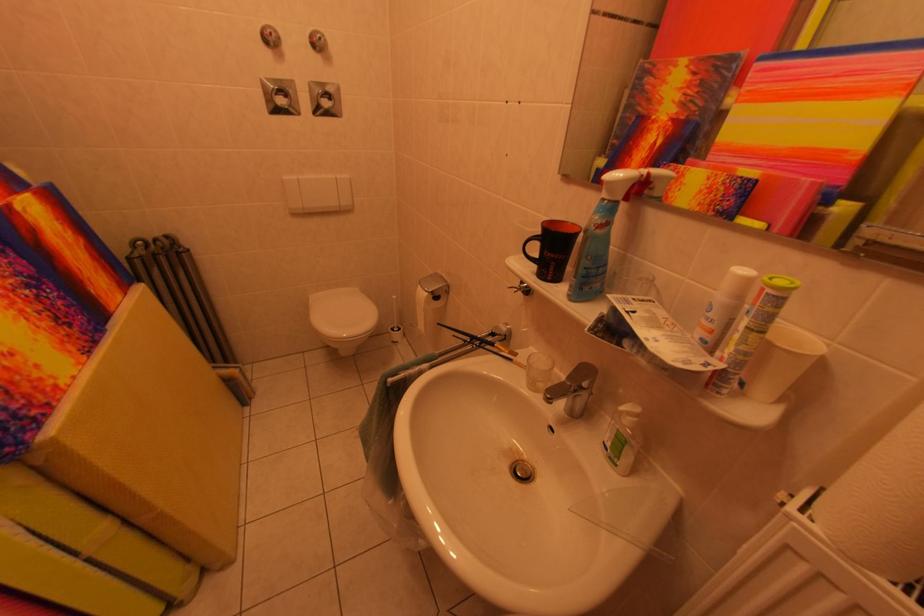
Find where to lift the toilet seat. Please return your answer as a coordinate pair (x, y).

(343, 317)